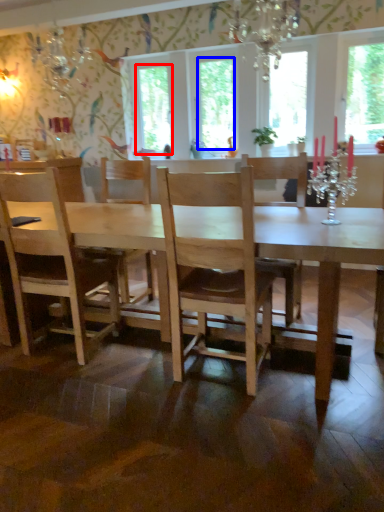
Question: Which object appears farthest to the camera in this image, window screen (highlighted by a red box) or window screen (highlighted by a blue box)?

Choices:
 (A) window screen
 (B) window screen

Answer: (A)